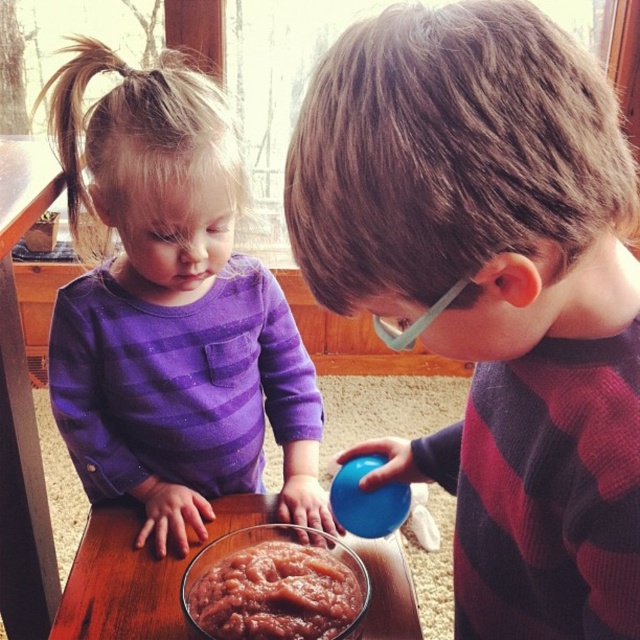
Question: Observing the image, what is the correct spatial positioning of transparent glass bowl at center in reference to clear plastic goggles at right?

Choices:
 (A) right
 (B) left

Answer: (B)

Question: Which of the following is the closest to the observer?

Choices:
 (A) purple soft fabric at upper left
 (B) transparent glass bowl at center
 (C) smooth brownish paste at center

Answer: (C)

Question: Can you confirm if smooth brownish paste at center is positioned to the left of clear plastic goggles at right?

Choices:
 (A) yes
 (B) no

Answer: (A)

Question: Which point is closer to the camera?

Choices:
 (A) purple soft fabric at upper left
 (B) blue rubber ball at center
 (C) clear plastic goggles at right

Answer: (B)

Question: Among these objects, which one is nearest to the camera?

Choices:
 (A) clear plastic goggles at right
 (B) transparent glass bowl at center

Answer: (A)

Question: Can you confirm if blue rubber ball at center is positioned above clear plastic goggles at right?

Choices:
 (A) yes
 (B) no

Answer: (B)